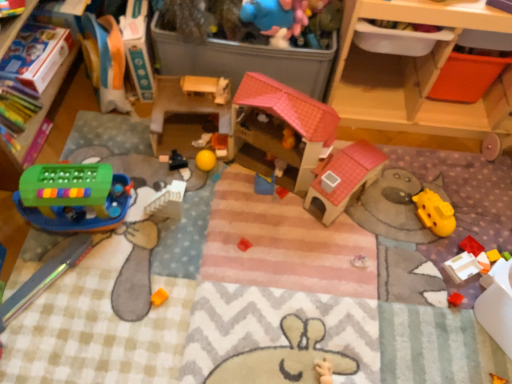
I want to click on free spot in front of green plastic boat at left, the ninth toy viewed from the right, so click(67, 287).